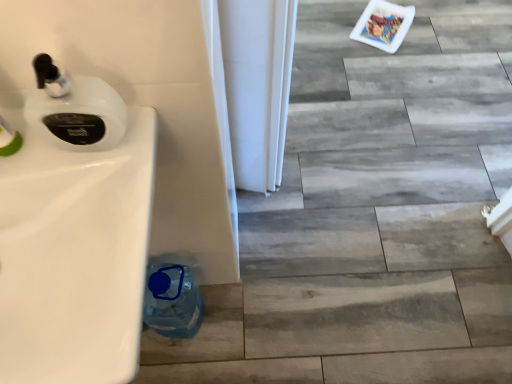
Question: Can you confirm if white glossy soap dispenser at upper left is smaller than white glossy sink at left?

Choices:
 (A) no
 (B) yes

Answer: (B)

Question: Is white glossy soap dispenser at upper left positioned before white glossy sink at left?

Choices:
 (A) yes
 (B) no

Answer: (B)

Question: Could white glossy sink at left be considered to be inside white glossy soap dispenser at upper left?

Choices:
 (A) no
 (B) yes

Answer: (A)

Question: Is white glossy soap dispenser at upper left shorter than white glossy sink at left?

Choices:
 (A) yes
 (B) no

Answer: (B)

Question: Is there a large distance between white glossy soap dispenser at upper left and white glossy sink at left?

Choices:
 (A) no
 (B) yes

Answer: (A)

Question: Considering the relative sizes of white glossy soap dispenser at upper left and white glossy sink at left in the image provided, is white glossy soap dispenser at upper left wider than white glossy sink at left?

Choices:
 (A) yes
 (B) no

Answer: (B)

Question: Can you confirm if white glossy sink at left is positioned to the left of white glossy soap dispenser at upper left?

Choices:
 (A) yes
 (B) no

Answer: (A)

Question: From a real-world perspective, is white glossy sink at left positioned over white glossy soap dispenser at upper left based on gravity?

Choices:
 (A) no
 (B) yes

Answer: (A)

Question: From the image's perspective, would you say white glossy sink at left is shown under white glossy soap dispenser at upper left?

Choices:
 (A) yes
 (B) no

Answer: (A)

Question: Considering the relative sizes of white glossy sink at left and white glossy soap dispenser at upper left in the image provided, is white glossy sink at left smaller than white glossy soap dispenser at upper left?

Choices:
 (A) no
 (B) yes

Answer: (A)

Question: From the image's perspective, is white glossy sink at left located above white glossy soap dispenser at upper left?

Choices:
 (A) yes
 (B) no

Answer: (B)

Question: Can you confirm if white glossy sink at left is thinner than white glossy soap dispenser at upper left?

Choices:
 (A) yes
 (B) no

Answer: (B)

Question: Is white glossy sink at left far from blue plastic bottle at lower left?

Choices:
 (A) no
 (B) yes

Answer: (A)